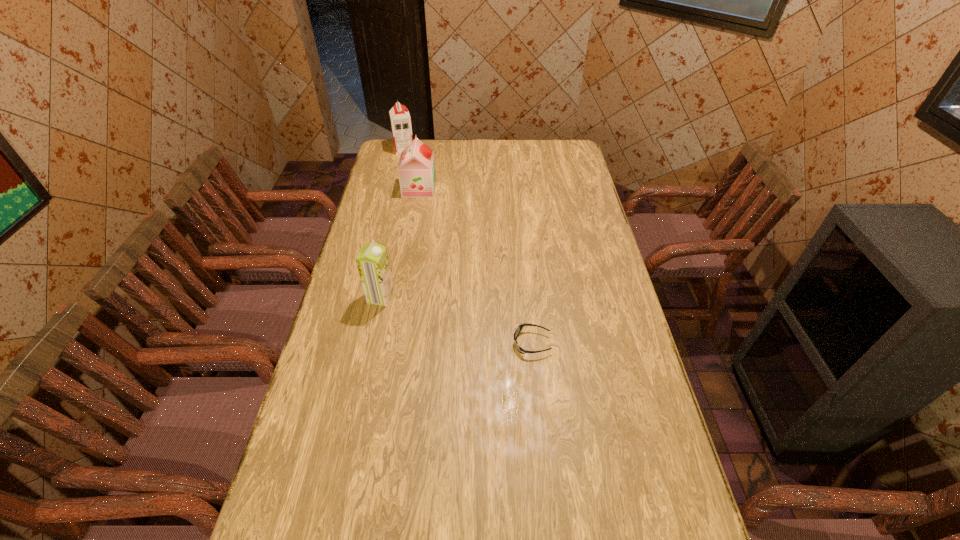
Identify which object is the third nearest to the sunglasses. Please provide its 2D coordinates. Your answer should be formatted as a tuple, i.e. [(x, y)], where the tuple contains the x and y coordinates of a point satisfying the conditions above.

[(400, 119)]

In order to click on object that is the closest one to the sunglasses in this screenshot , I will do `click(372, 261)`.

You are a GUI agent. You are given a task and a screenshot of the screen. Output one action in this format:
    pyautogui.click(x=<x>, y=<y>)
    Task: Click on the second closest soya milk to the nearest soya milk
    
    Given the screenshot: What is the action you would take?
    pyautogui.click(x=400, y=119)

Point out which soya milk is positioned as the nearest to the nearest soya milk. Please provide its 2D coordinates. Your answer should be formatted as a tuple, i.e. [(x, y)], where the tuple contains the x and y coordinates of a point satisfying the conditions above.

[(417, 176)]

Locate an element on the screen. The image size is (960, 540). vacant space that satisfies the following two spatial constraints: 1. with the cap open on the second farthest soya milk; 2. on the front side of the nearest soya milk is located at coordinates point(400,297).

Where is `vacant region that satisfies the following two spatial constraints: 1. on the front side of the second nearest object; 2. on the left side of the farthest object`? vacant region that satisfies the following two spatial constraints: 1. on the front side of the second nearest object; 2. on the left side of the farthest object is located at coordinates (369, 297).